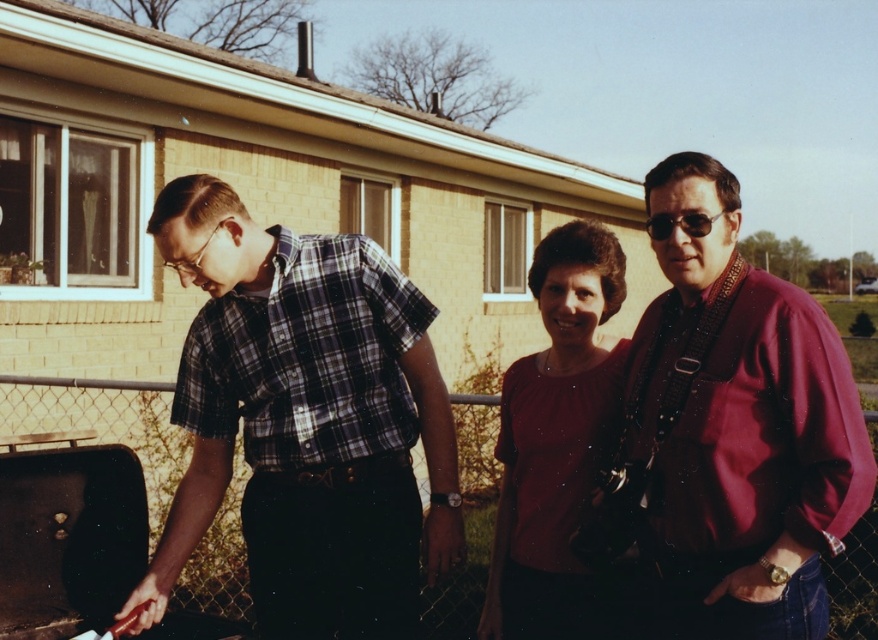
Who is more forward, (153, 385) or (668, 234)?

Positioned in front is point (668, 234).

The width and height of the screenshot is (878, 640). What do you see at coordinates (104, 422) in the screenshot?
I see `metal chain-link fence at center` at bounding box center [104, 422].

The height and width of the screenshot is (640, 878). I want to click on metal chain-link fence at center, so click(x=104, y=422).

How much distance is there between plaid shirt at center and shiny black sunglasses at right?

1.18 meters

What do you see at coordinates (304, 420) in the screenshot? I see `plaid shirt at center` at bounding box center [304, 420].

I want to click on plaid shirt at center, so click(304, 420).

Can you confirm if matte red blouse at center is positioned above shiny black sunglasses at right?

No.

Between matte red blouse at center and shiny black sunglasses at right, which one is positioned lower?

matte red blouse at center is lower down.

Identify the location of matte red blouse at center. (555, 440).

Where is `matte red blouse at center`? This screenshot has height=640, width=878. matte red blouse at center is located at coordinates (555, 440).